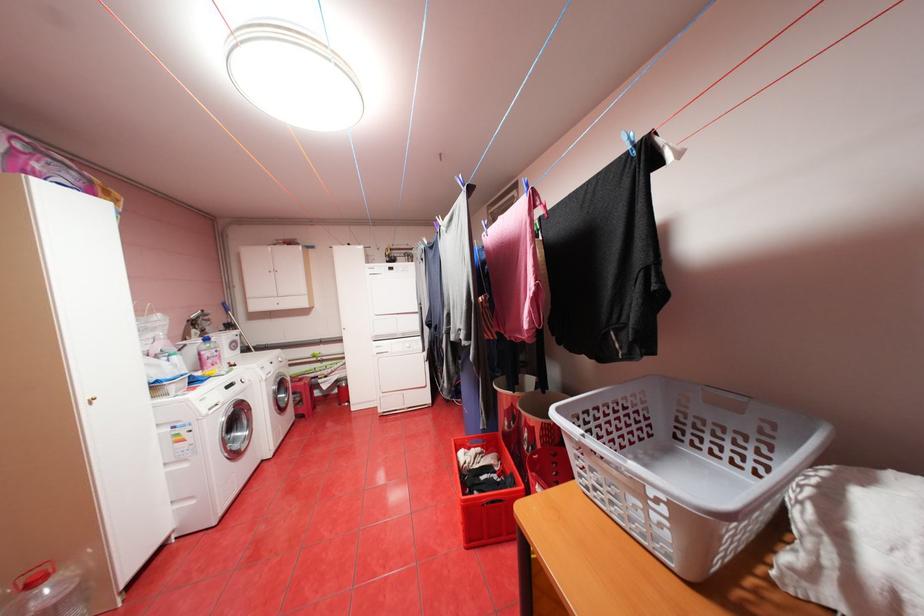
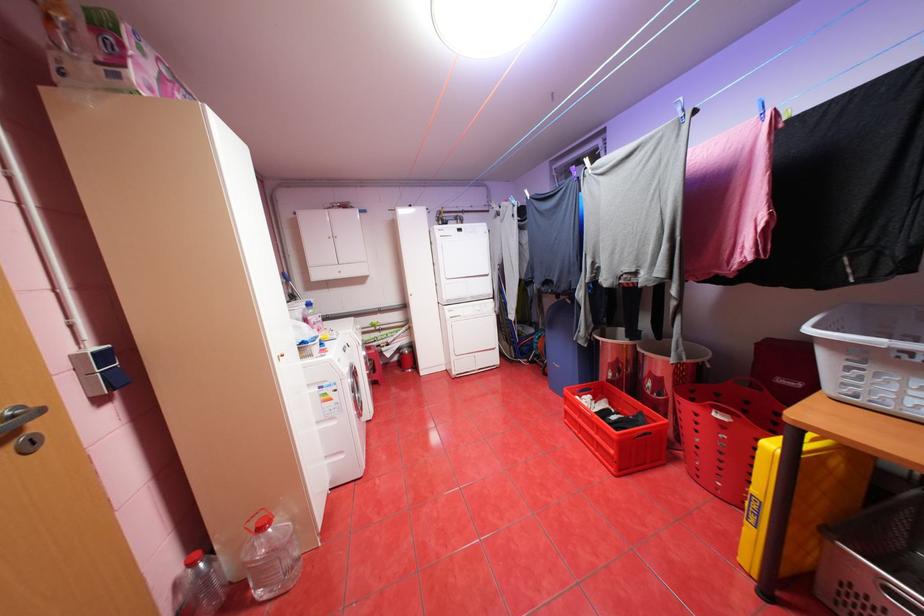
Question: What movement of the cameraman would produce the second image?

Choices:
 (A) Left
 (B) Right
 (C) Forward
 (D) Backward

Answer: (A)